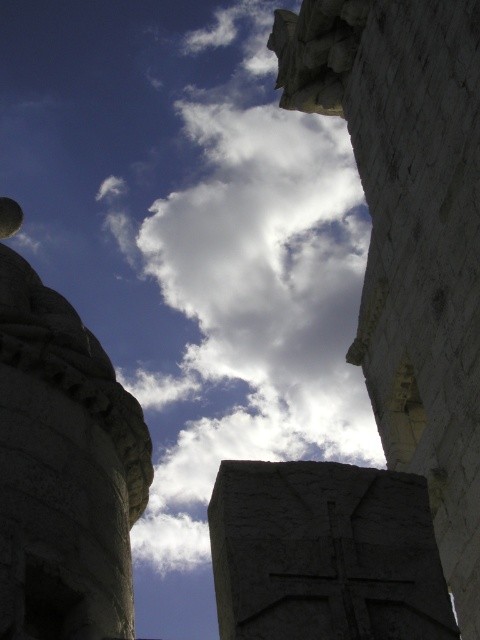
Image resolution: width=480 pixels, height=640 pixels. Identify the location of white fluffy cloud at center. (248, 285).

Does white fluffy cloud at center come behind white stone pillar at upper center?

Yes, it is behind white stone pillar at upper center.

Is point (317, 240) farther from camera compared to point (359, 360)?

Yes, point (317, 240) is behind point (359, 360).

In order to click on white fluffy cloud at center in this screenshot , I will do `click(248, 285)`.